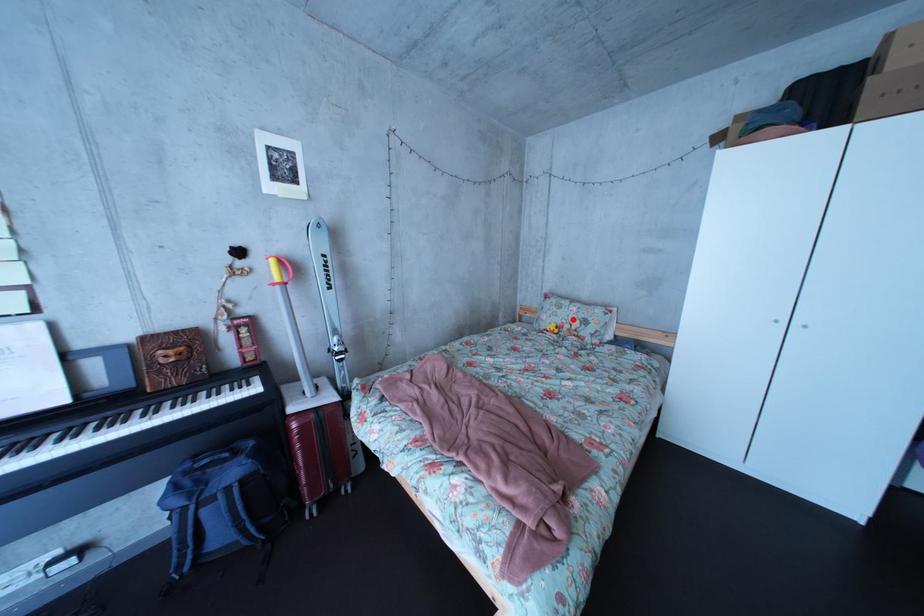
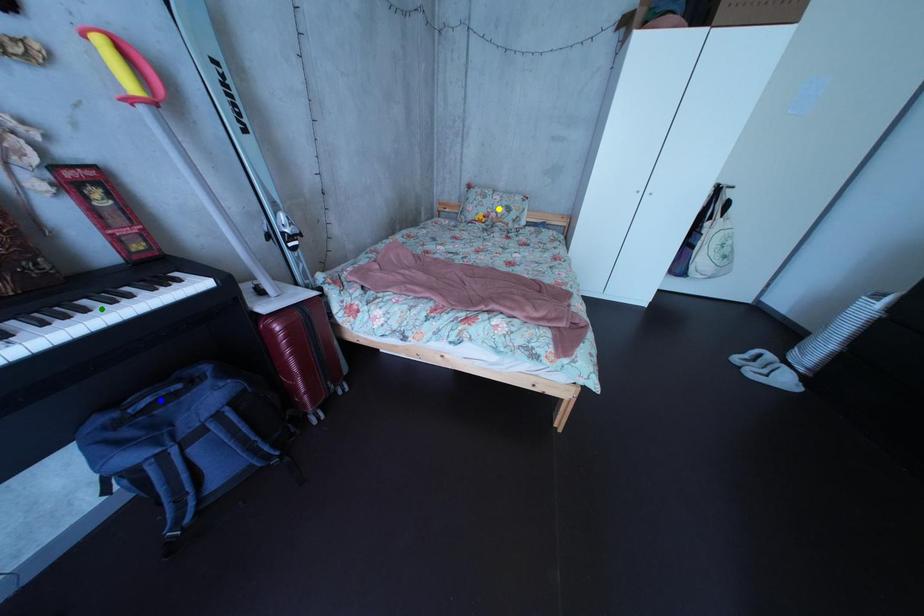
Question: I am providing you with two images of the same scene from different viewpoints. A red point is marked on the first image. You are given multiple points on the second image. Which point in image 2 represents the same 3d spot as the red point in image 1?

Choices:
 (A) green point
 (B) blue point
 (C) yellow point

Answer: (C)